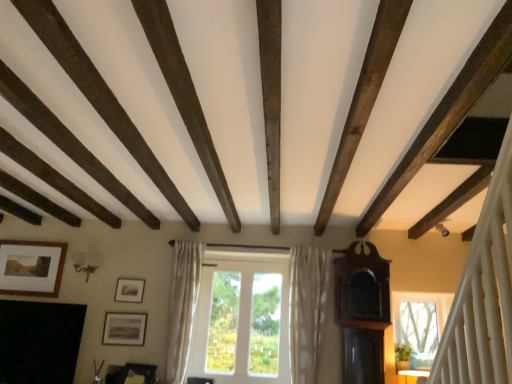
Question: Is there a large distance between matte silver picture frame at center-left, which is the 2th picture frame from bottom to top, and white glass window at center?

Choices:
 (A) yes
 (B) no

Answer: (B)

Question: Is matte silver picture frame at center-left, which is the 2th picture frame from bottom to top, positioned behind white glass window at center?

Choices:
 (A) yes
 (B) no

Answer: (A)

Question: From the image's perspective, would you say matte silver picture frame at center-left, which is the 2th picture frame from bottom to top, is shown under white glass window at center?

Choices:
 (A) yes
 (B) no

Answer: (B)

Question: Is the surface of matte silver picture frame at center-left, acting as the 2th picture frame starting from the top, in direct contact with white glass window at center?

Choices:
 (A) no
 (B) yes

Answer: (A)

Question: Does matte silver picture frame at center-left, which is the 2th picture frame from bottom to top, have a greater width compared to white glass window at center?

Choices:
 (A) yes
 (B) no

Answer: (B)

Question: In the image, is white sheer curtain at center, the first curtain from the left, positioned in front of or behind white glass window at center?

Choices:
 (A) front
 (B) behind

Answer: (A)

Question: From a real-world perspective, is white sheer curtain at center, the first curtain from the left, above or below white glass window at center?

Choices:
 (A) below
 (B) above

Answer: (B)

Question: Based on their sizes in the image, would you say white sheer curtain at center, the second curtain positioned from the right, is bigger or smaller than white glass window at center?

Choices:
 (A) big
 (B) small

Answer: (A)

Question: From their relative heights in the image, would you say white sheer curtain at center, the second curtain positioned from the right, is taller or shorter than white glass window at center?

Choices:
 (A) short
 (B) tall

Answer: (B)

Question: Is point (182, 345) closer or farther from the camera than point (309, 273)?

Choices:
 (A) closer
 (B) farther

Answer: (A)

Question: In terms of width, does white sheer curtain at center, the second curtain positioned from the right, look wider or thinner when compared to white dotted fabric curtain at center, which is the 2th curtain from left to right?

Choices:
 (A) thin
 (B) wide

Answer: (A)

Question: Relative to white dotted fabric curtain at center, marked as the 1th curtain in a right-to-left arrangement, is white sheer curtain at center, the first curtain from the left, in front or behind?

Choices:
 (A) behind
 (B) front

Answer: (A)

Question: From the image's perspective, is white sheer curtain at center, the second curtain positioned from the right, positioned above or below white dotted fabric curtain at center, which is the 2th curtain from left to right?

Choices:
 (A) above
 (B) below

Answer: (A)

Question: Is wooden picture frame at lower center spatially inside wooden framed picture at upper left, the 3th picture frame when ordered from right to left, or outside of it?

Choices:
 (A) inside
 (B) outside

Answer: (B)

Question: Looking at their shapes, would you say wooden picture frame at lower center is wider or thinner than wooden framed picture at upper left, the first picture frame when ordered from top to bottom?

Choices:
 (A) wide
 (B) thin

Answer: (A)